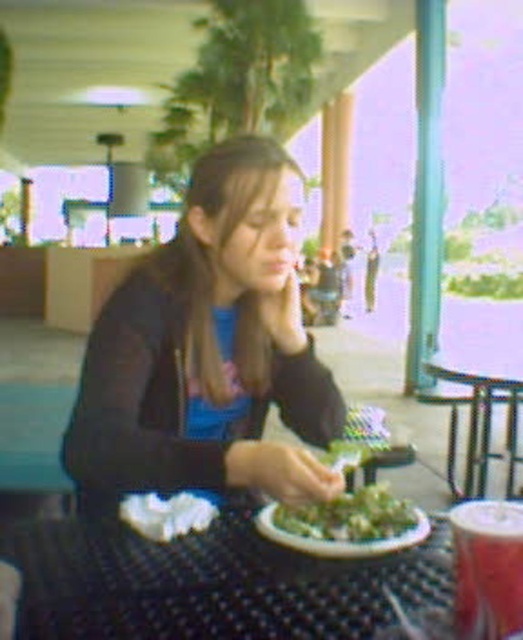
You are a customer in a restaurant and want to place your phone on the table. The table is cluttered with a matte black sweater at center. Where should you place your phone to avoid placing it on the sweater?

You should place your phone on the table away from the matte black sweater at center, such as near the edge or next to the red cup to the right of the plate.

You are a server at a restaurant and need to place a new order on the table. The order includes a salad and a drink. The table has a matte black sweater at center and a translucent plastic cup at lower right. Where should you place the salad and drink to ensure they are not under the sweater?

Place the salad and drink away from the matte black sweater at center since it is closer to the viewer than the translucent plastic cup at lower right, so positioning them behind or beside the sweater would keep them visible and accessible.

You are a waiter in a restaurant and need to deliver a drink to the customer seated at the table. The customer is looking at the green leafy salad at center. You have a tray with a drink that needs to be placed on the table. Where should you place the drink so it doesn not block the customer view of the salad?

Place the drink to the right of the green leafy salad at center, as the red cup is already there and it is positioned to the right, so placing it there would not block the customer view of the salad.